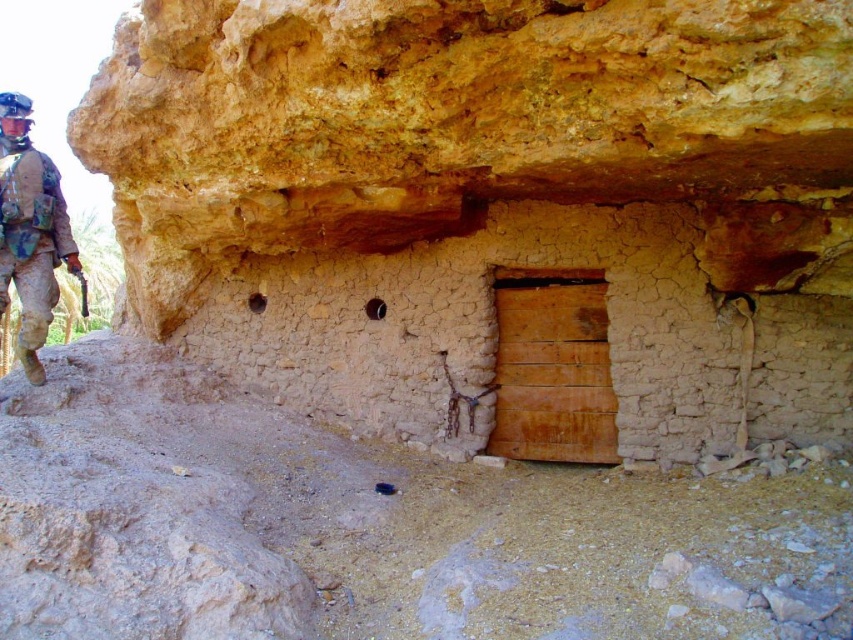
Is cracked beige wall at center bigger than camouflage fabric uniform at left?

Yes, cracked beige wall at center is bigger than camouflage fabric uniform at left.

The width and height of the screenshot is (853, 640). In order to click on cracked beige wall at center in this screenshot , I will do pos(494,211).